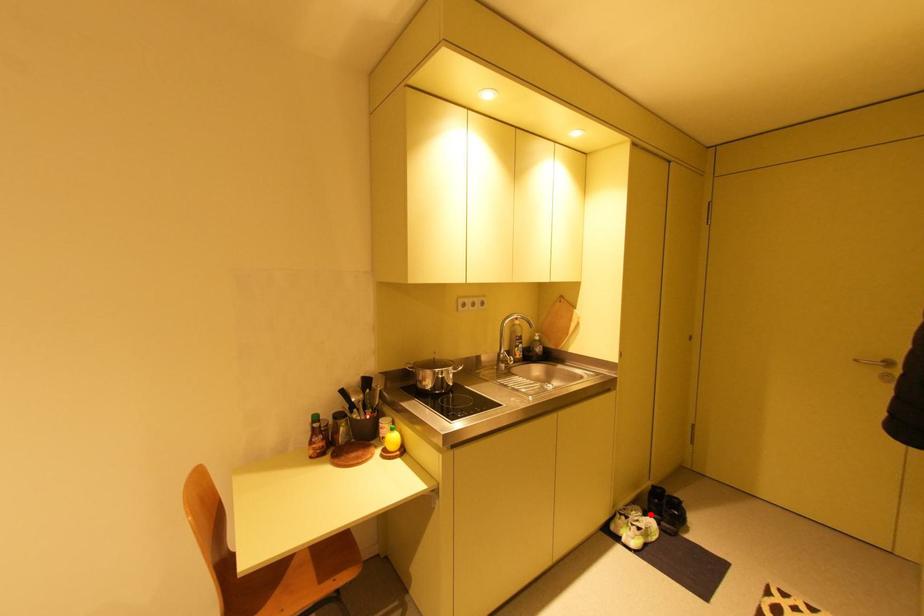
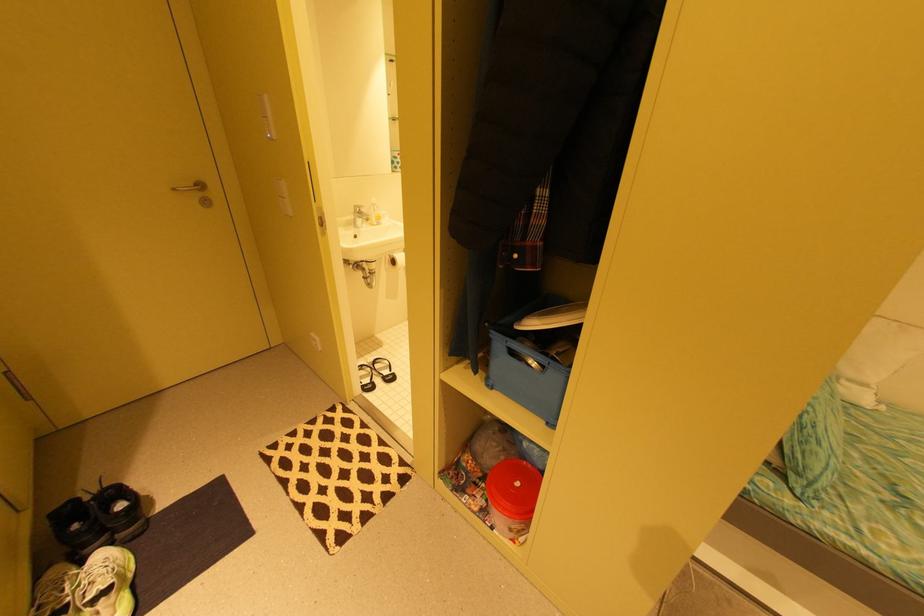
Where in the second image is the point corresponding to the highlighted location from the first image?

(90, 562)